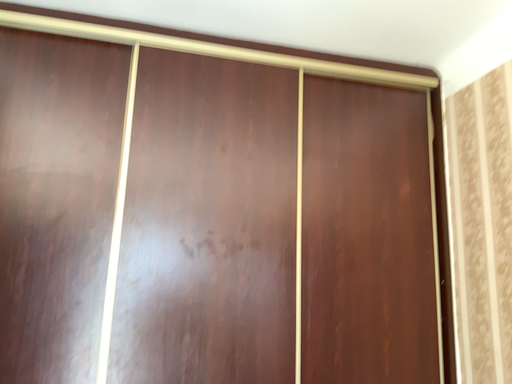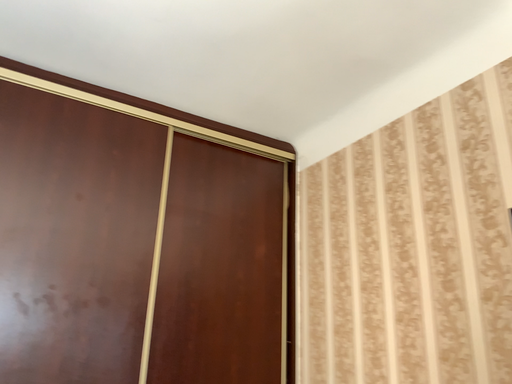
Question: Which way did the camera rotate in the video?

Choices:
 (A) rotated left
 (B) rotated right

Answer: (B)